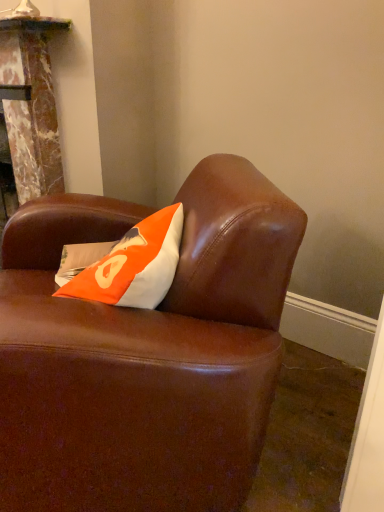
Question: Should I look upward or downward to see brown leather couch at center?

Choices:
 (A) down
 (B) up

Answer: (A)